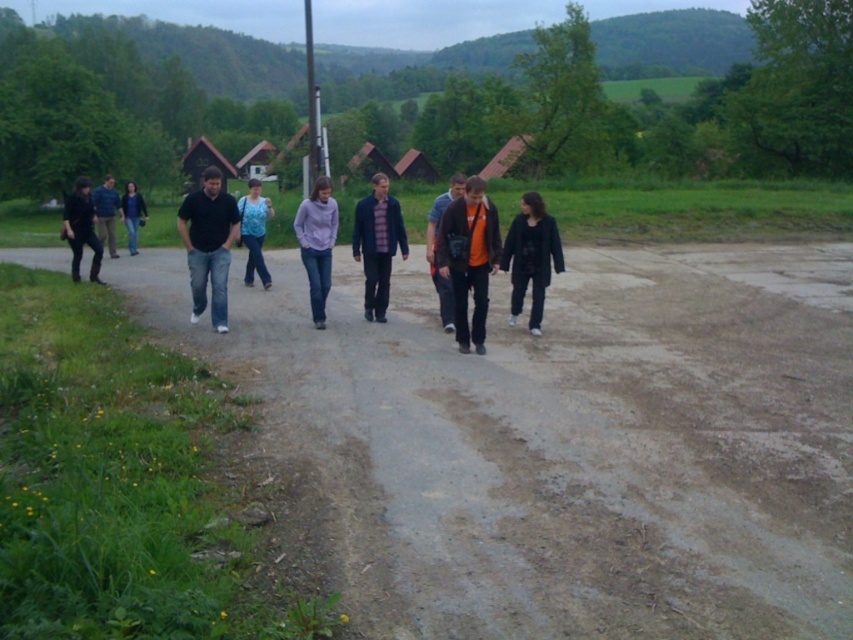
Question: Among these points, which one is farthest from the camera?

Choices:
 (A) (563, 324)
 (B) (73, 275)
 (C) (483, 240)
 (D) (206, 236)

Answer: (B)

Question: Does brown dirt track at center appear over orange cotton shirt at center?

Choices:
 (A) no
 (B) yes

Answer: (B)

Question: Is orange cotton shirt at center closer to camera compared to orange fabric jacket at center?

Choices:
 (A) yes
 (B) no

Answer: (B)

Question: Among these objects, which one is nearest to the camera?

Choices:
 (A) purple matte shirt at center
 (B) dark gray jeans at left
 (C) black matte jacket at center

Answer: (C)

Question: Can you confirm if black matte shirt at center is wider than blue jeans at left?

Choices:
 (A) no
 (B) yes

Answer: (B)

Question: Which is farther from the orange cotton shirt at center?

Choices:
 (A) purple matte shirt at center
 (B) matte black shirt at center

Answer: (B)